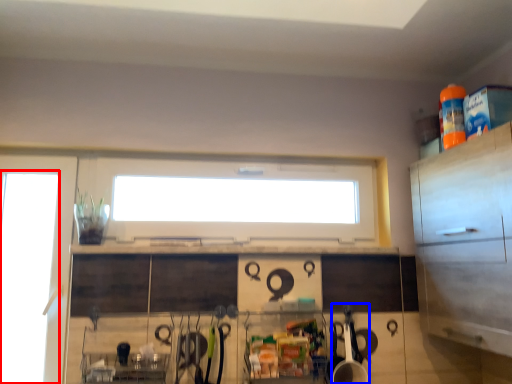
Question: Which point is closer to the camera, glass door (highlighted by a red box) or appliance (highlighted by a blue box)?

Choices:
 (A) glass door
 (B) appliance

Answer: (B)